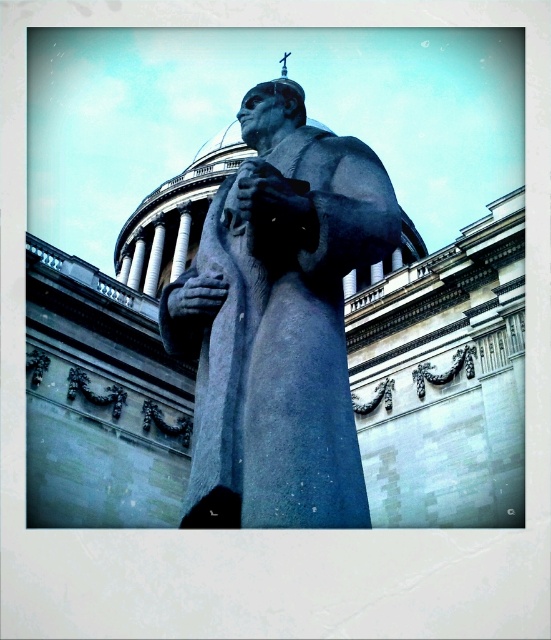
Question: Which of these objects is positioned farthest from the matte gray stone hand at center?

Choices:
 (A) gray stone statue at center
 (B) white marble pillar at center
 (C) smooth gray hand at center

Answer: (B)

Question: Estimate the real-world distances between objects in this image. Which object is closer to the smooth gray hand at center?

Choices:
 (A) white marble pillar at center
 (B) gray stone statue at center

Answer: (B)

Question: Can you confirm if smooth gray hand at center is wider than matte gray stone hand at center?

Choices:
 (A) no
 (B) yes

Answer: (A)

Question: Which point is closer to the camera taking this photo?

Choices:
 (A) (235, 225)
 (B) (179, 248)
 (C) (186, 314)

Answer: (C)

Question: Is matte gray stone hand at center positioned before white marble pillar at center?

Choices:
 (A) yes
 (B) no

Answer: (A)

Question: In this image, where is gray stone statue at center located relative to white marble pillar at center?

Choices:
 (A) below
 (B) above

Answer: (A)